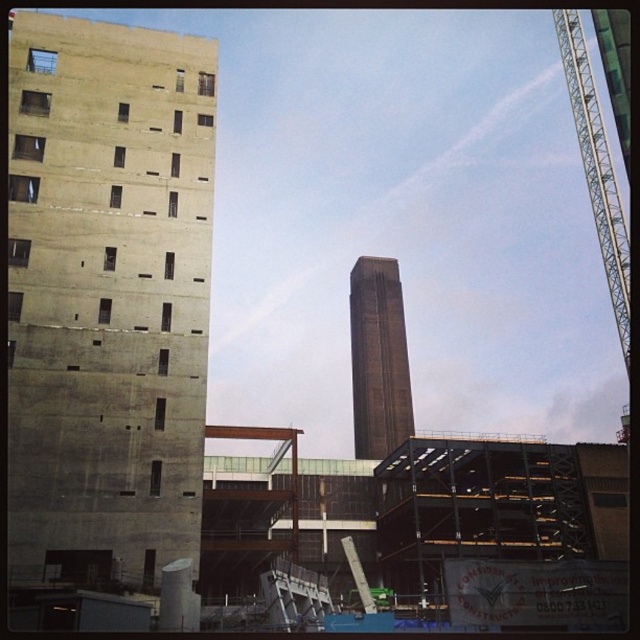
Which is in front, point (154, 196) or point (600, 172)?

Positioned in front is point (154, 196).

Based on the photo, can you confirm if concrete tower at left is smaller than green metallic crane at upper right?

Yes, concrete tower at left is smaller than green metallic crane at upper right.

Is point (157, 188) closer to viewer compared to point (589, 120)?

That is True.

Locate an element on the screen. concrete tower at left is located at coordinates (108, 291).

Is brown brick tower at center to the left of green metallic crane at upper right from the viewer's perspective?

Yes, brown brick tower at center is to the left of green metallic crane at upper right.

Is brown brick tower at center behind green metallic crane at upper right?

Yes.

Does point (358, 392) come behind point (554, 22)?

No, (358, 392) is in front of (554, 22).

Locate an element on the screen. brown brick tower at center is located at coordinates (378, 358).

Which is in front, point (8, 208) or point (392, 336)?

Positioned in front is point (8, 208).

Which is more to the right, concrete tower at left or brown brick tower at center?

brown brick tower at center

Is point (45, 170) behind point (365, 394)?

No, it is in front of (365, 394).

The width and height of the screenshot is (640, 640). Identify the location of concrete tower at left. (108, 291).